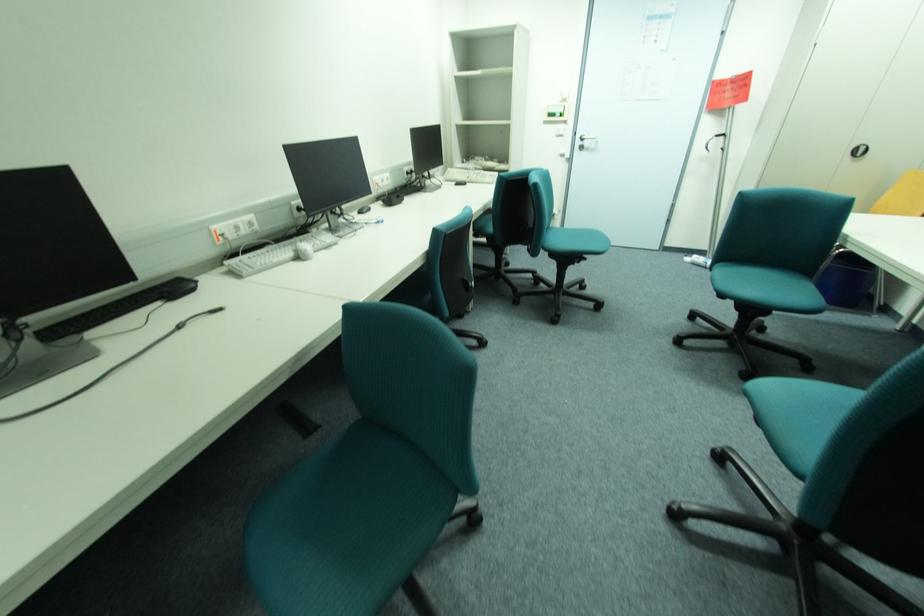
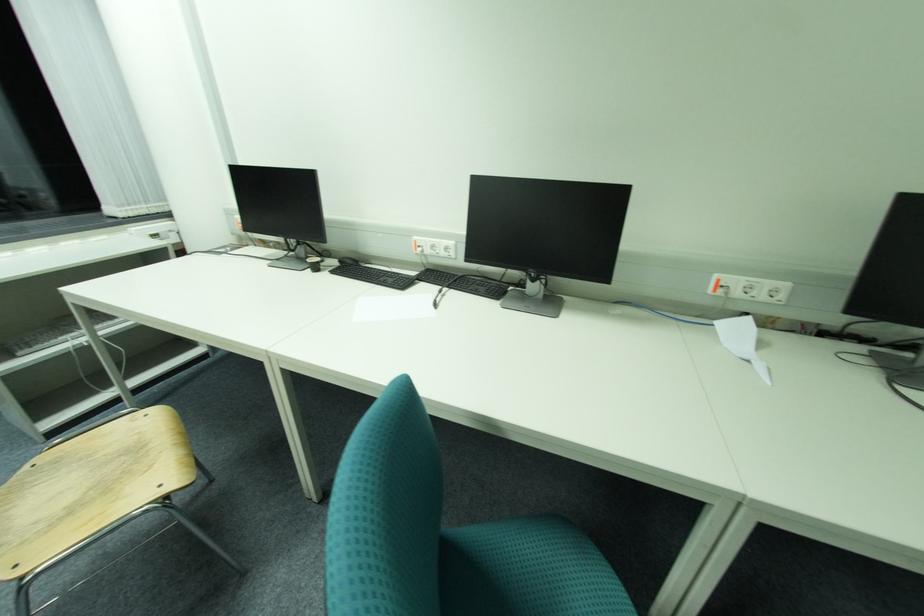
Consider the image. The images are taken continuously from a first-person perspective. In which direction is your viewpoint rotating?

The rotation direction of the camera is left-down.